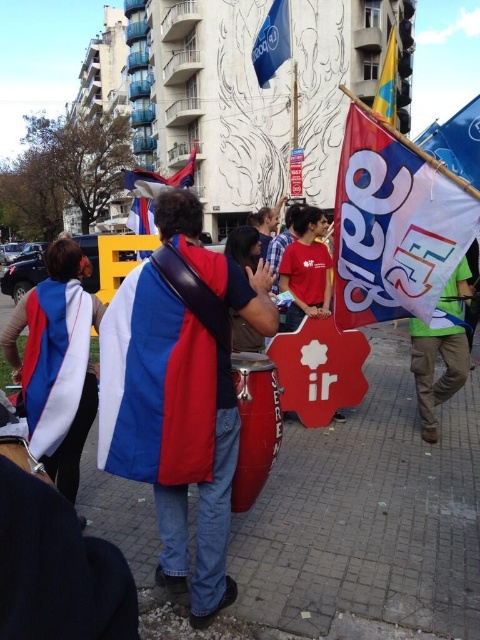
Question: Is white fabric flag at upper right wider than blue fabric flag at upper center?

Choices:
 (A) no
 (B) yes

Answer: (B)

Question: Which point appears closest to the camera in this image?

Choices:
 (A) pos(273,28)
 (B) pos(137,212)
 (C) pos(416,342)

Answer: (C)

Question: Which object is positioned farthest from the white fabric flag at upper right?

Choices:
 (A) red and blue fabric at center
 (B) blue fabric flag at upper center
 (C) blue and white fabric flag at center

Answer: (C)

Question: Is the position of red and blue fabric at center less distant than that of blue fabric flag at upper center?

Choices:
 (A) yes
 (B) no

Answer: (A)

Question: Among these objects, which one is farthest from the camera?

Choices:
 (A) red and blue fabric at center
 (B) green fabric flag at right

Answer: (B)

Question: Is blue and white fabric flag at center wider than yellow fabric flag at upper right?

Choices:
 (A) yes
 (B) no

Answer: (B)